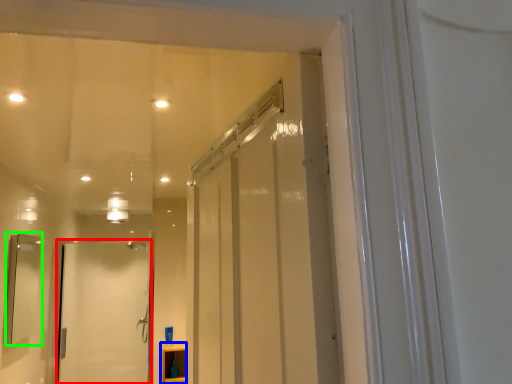
Question: Considering the real-world distances, which object is farthest from door (highlighted by a red box)? cabinetry (highlighted by a blue box) or mirror (highlighted by a green box)?

Choices:
 (A) cabinetry
 (B) mirror

Answer: (B)